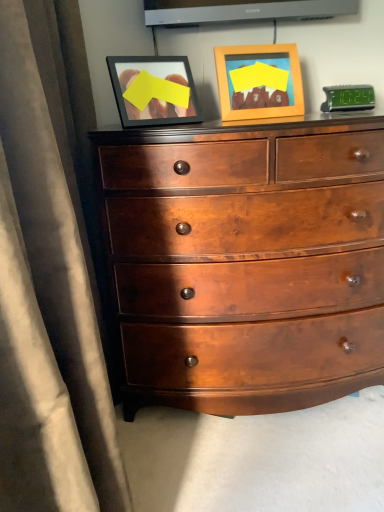
Describe the element at coordinates (259, 81) in the screenshot. I see `wooden picture frame at upper center` at that location.

Identify the location of wooden picture frame at upper center. (259, 81).

What do you see at coordinates (246, 263) in the screenshot?
I see `glossy wood chest of drawers at center` at bounding box center [246, 263].

Where is `glossy wood chest of drawers at center`? The image size is (384, 512). glossy wood chest of drawers at center is located at coordinates [246, 263].

Identify the location of wooden picture frame at upper center. (259, 81).

Between glossy wood chest of drawers at center and wooden picture frame at upper center, which one appears on the left side from the viewer's perspective?

glossy wood chest of drawers at center.

Consider the image. Which is behind, glossy wood chest of drawers at center or wooden picture frame at upper center?

Positioned behind is wooden picture frame at upper center.

Which is nearer, (244, 273) or (289, 85)?

The point (244, 273) is in front.

From the image's perspective, between glossy wood chest of drawers at center and wooden picture frame at upper center, which one is located above?

wooden picture frame at upper center.

From a real-world perspective, is glossy wood chest of drawers at center on wooden picture frame at upper center?

Incorrect, from a real-world perspective, glossy wood chest of drawers at center is lower than wooden picture frame at upper center.

Between glossy wood chest of drawers at center and wooden picture frame at upper center, which one has larger width?

With larger width is glossy wood chest of drawers at center.

Who is taller, glossy wood chest of drawers at center or wooden picture frame at upper center?

Standing taller between the two is glossy wood chest of drawers at center.

Considering the relative sizes of glossy wood chest of drawers at center and wooden picture frame at upper center in the image provided, is glossy wood chest of drawers at center bigger than wooden picture frame at upper center?

Yes.

Is glossy wood chest of drawers at center spatially inside wooden picture frame at upper center, or outside of it?

glossy wood chest of drawers at center is spatially situated outside wooden picture frame at upper center.

Are glossy wood chest of drawers at center and wooden picture frame at upper center far apart?

No, glossy wood chest of drawers at center is not far away from wooden picture frame at upper center.

Is glossy wood chest of drawers at center facing away from wooden picture frame at upper center?

No, glossy wood chest of drawers at center is not facing the opposite direction of wooden picture frame at upper center.

Measure the distance between glossy wood chest of drawers at center and wooden picture frame at upper center.

Answer: The distance of glossy wood chest of drawers at center from wooden picture frame at upper center is 20.55 inches.

At what (x,y) coordinates should I click in order to perform the action: click on picture frame behind the glossy wood chest of drawers at center. Please return your answer as a coordinate pair (x, y). The height and width of the screenshot is (512, 384). Looking at the image, I should click on (259, 81).

Is wooden picture frame at upper center to the left or to the right of glossy wood chest of drawers at center in the image?

From the image, it's evident that wooden picture frame at upper center is to the right of glossy wood chest of drawers at center.

Considering the positions of objects wooden picture frame at upper center and glossy wood chest of drawers at center in the image provided, who is in front, wooden picture frame at upper center or glossy wood chest of drawers at center?

glossy wood chest of drawers at center is more forward.

Is point (284, 102) positioned before point (260, 404)?

Yes, point (284, 102) is in front of point (260, 404).

From the image's perspective, is wooden picture frame at upper center on glossy wood chest of drawers at center?

Yes, from the image's perspective, wooden picture frame at upper center is on top of glossy wood chest of drawers at center.

From a real-world perspective, does wooden picture frame at upper center stand above glossy wood chest of drawers at center?

Indeed, from a real-world perspective, wooden picture frame at upper center stands above glossy wood chest of drawers at center.

Considering the relative sizes of wooden picture frame at upper center and glossy wood chest of drawers at center in the image provided, is wooden picture frame at upper center wider than glossy wood chest of drawers at center?

In fact, wooden picture frame at upper center might be narrower than glossy wood chest of drawers at center.

Can you confirm if wooden picture frame at upper center is shorter than glossy wood chest of drawers at center?

Yes.

Who is bigger, wooden picture frame at upper center or glossy wood chest of drawers at center?

Bigger between the two is glossy wood chest of drawers at center.

Is wooden picture frame at upper center positioned beyond the bounds of glossy wood chest of drawers at center?

Yes.

Are wooden picture frame at upper center and glossy wood chest of drawers at center far apart?

Actually, wooden picture frame at upper center and glossy wood chest of drawers at center are a little close together.

Is wooden picture frame at upper center facing away from glossy wood chest of drawers at center?

wooden picture frame at upper center does not have its back to glossy wood chest of drawers at center.

Can you tell me how much wooden picture frame at upper center and glossy wood chest of drawers at center differ in facing direction?

The facing directions of wooden picture frame at upper center and glossy wood chest of drawers at center are 10.5 degrees apart.

How distant is wooden picture frame at upper center from glossy wood chest of drawers at center?

The distance of wooden picture frame at upper center from glossy wood chest of drawers at center is 20.55 inches.

Locate an element on the screen. chest of drawers on the left side of wooden picture frame at upper center is located at coordinates (246, 263).

Where is `picture frame lying on the right of glossy wood chest of drawers at center`? This screenshot has width=384, height=512. picture frame lying on the right of glossy wood chest of drawers at center is located at coordinates (259, 81).

Identify the location of picture frame above the glossy wood chest of drawers at center (from a real-world perspective). The width and height of the screenshot is (384, 512). (259, 81).